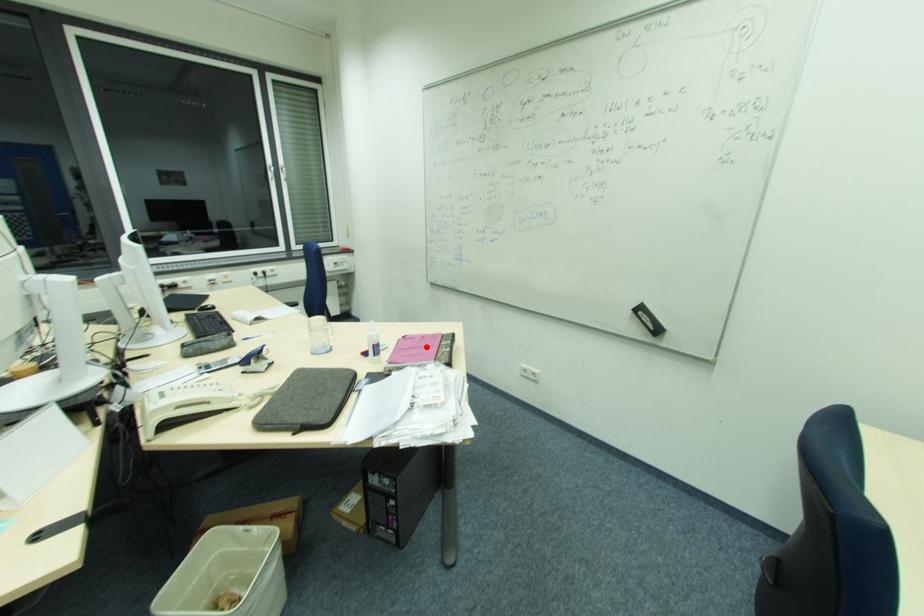
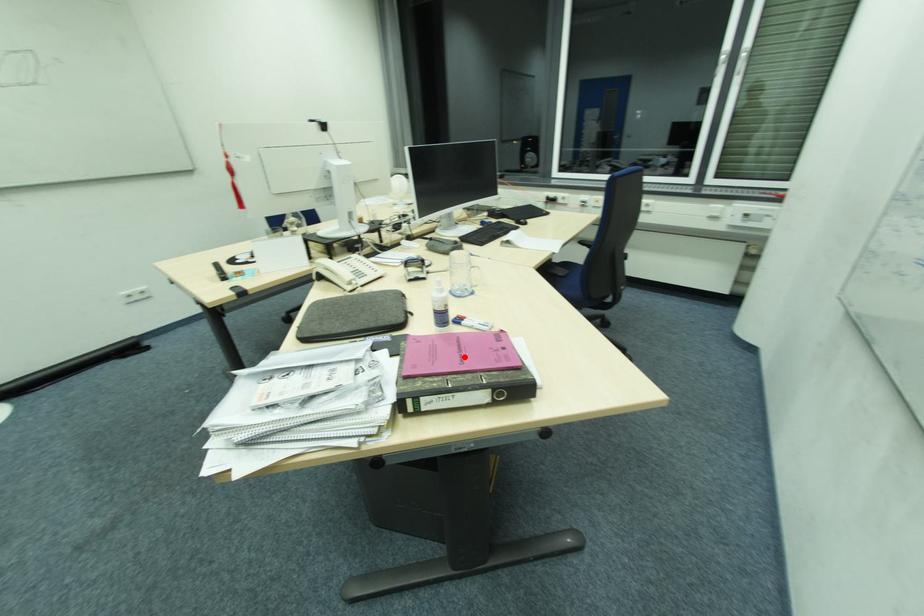
I am providing you with two images of the same scene from different viewpoints. A red point is marked on the first image and another point is marked on the second image. Is the red point in image1 aligned with the point shown in image2?

Yes